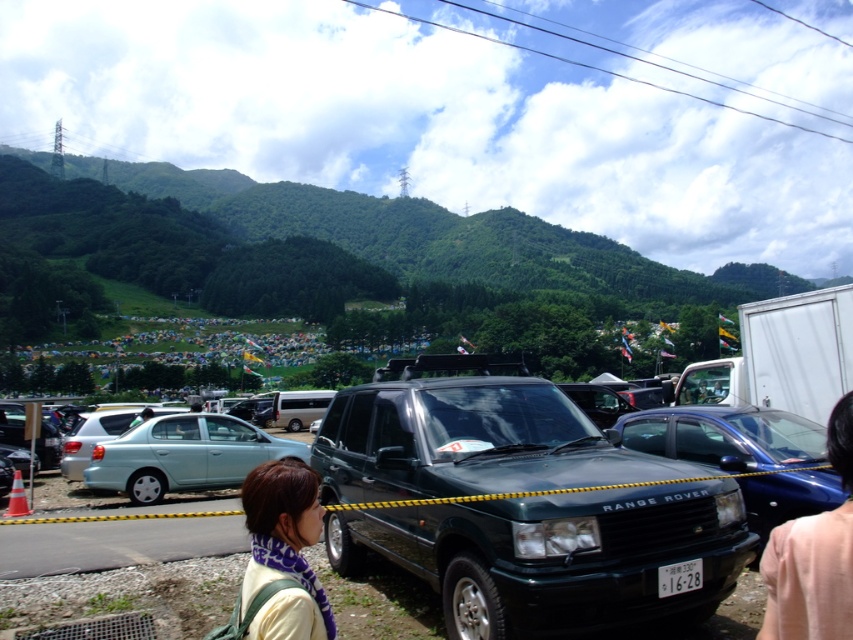
Does metallic green suv at center have a smaller size compared to smooth skin at lower right?

No, metallic green suv at center is not smaller than smooth skin at lower right.

Does metallic green suv at center have a lesser width compared to smooth skin at lower right?

Incorrect, metallic green suv at center's width is not less than smooth skin at lower right's.

Between point (437, 540) and point (831, 413), which one is positioned in front?

Positioned in front is point (831, 413).

Locate an element on the screen. The height and width of the screenshot is (640, 853). metallic green suv at center is located at coordinates (519, 504).

Can you confirm if light yellow fabric at center is thinner than light blue metallic sedan at center-left?

Correct, light yellow fabric at center's width is less than light blue metallic sedan at center-left's.

Describe the element at coordinates (283, 552) in the screenshot. I see `light yellow fabric at center` at that location.

I want to click on light yellow fabric at center, so click(283, 552).

Can you confirm if metallic green range rover at center is positioned above light yellow fabric at center?

No.

This screenshot has width=853, height=640. What do you see at coordinates (724, 436) in the screenshot?
I see `metallic green range rover at center` at bounding box center [724, 436].

What do you see at coordinates (724, 436) in the screenshot? The image size is (853, 640). I see `metallic green range rover at center` at bounding box center [724, 436].

Where is `metallic green range rover at center`? This screenshot has width=853, height=640. metallic green range rover at center is located at coordinates (724, 436).